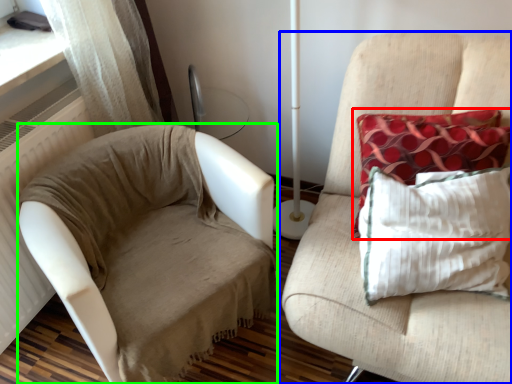
Question: Based on their relative distances, which object is farther from pillow (highlighted by a red box)? Choose from furniture (highlighted by a blue box) and studio couch (highlighted by a green box).

Choices:
 (A) furniture
 (B) studio couch

Answer: (B)